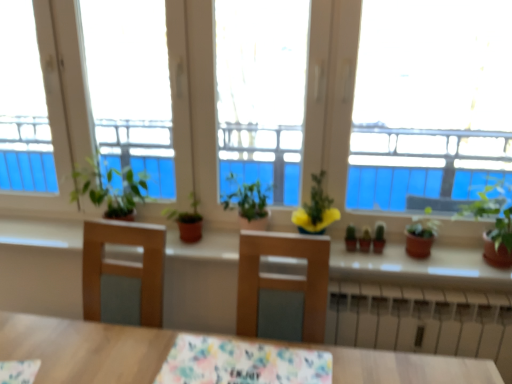
Question: Is green matte plant at center, the 5th houseplant from the right, in contact with transparent glass window at center?

Choices:
 (A) yes
 (B) no

Answer: (B)

Question: Does green matte plant at center, the 5th houseplant from the right, have a greater width compared to transparent glass window at center?

Choices:
 (A) yes
 (B) no

Answer: (A)

Question: Can you confirm if green matte plant at center, the 5th houseplant from the right, is smaller than transparent glass window at center?

Choices:
 (A) no
 (B) yes

Answer: (B)

Question: From a real-world perspective, is green matte plant at center, the 5th houseplant from the right, located higher than transparent glass window at center?

Choices:
 (A) yes
 (B) no

Answer: (B)

Question: Considering the relative sizes of green matte plant at center, the 5th houseplant from the right, and transparent glass window at center in the image provided, is green matte plant at center, the 5th houseplant from the right, taller than transparent glass window at center?

Choices:
 (A) no
 (B) yes

Answer: (A)

Question: Can transparent glass window at center be found inside green matte plant at center, the 5th houseplant from the right?

Choices:
 (A) yes
 (B) no

Answer: (B)

Question: From a real-world perspective, is yellow matte flower pot at center, the third houseplant when ordered from left to right, positioned under white metallic radiator at lower center based on gravity?

Choices:
 (A) yes
 (B) no

Answer: (B)

Question: Considering the relative positions of yellow matte flower pot at center, the third houseplant when ordered from left to right, and white metallic radiator at lower center in the image provided, is yellow matte flower pot at center, the third houseplant when ordered from left to right, to the left of white metallic radiator at lower center from the viewer's perspective?

Choices:
 (A) yes
 (B) no

Answer: (A)

Question: Is yellow matte flower pot at center, the third houseplant when ordered from left to right, directly adjacent to white metallic radiator at lower center?

Choices:
 (A) yes
 (B) no

Answer: (B)

Question: Considering the relative positions of yellow matte flower pot at center, which ranks as the third houseplant in right-to-left order, and white metallic radiator at lower center in the image provided, is yellow matte flower pot at center, which ranks as the third houseplant in right-to-left order, behind white metallic radiator at lower center?

Choices:
 (A) yes
 (B) no

Answer: (B)

Question: Could white metallic radiator at lower center be considered to be inside yellow matte flower pot at center, the third houseplant when ordered from left to right?

Choices:
 (A) no
 (B) yes

Answer: (A)

Question: Considering the relative sizes of yellow matte flower pot at center, which ranks as the third houseplant in right-to-left order, and white metallic radiator at lower center in the image provided, is yellow matte flower pot at center, which ranks as the third houseplant in right-to-left order, smaller than white metallic radiator at lower center?

Choices:
 (A) yes
 (B) no

Answer: (A)

Question: Is floral fabric tablecloth at center thinner than green matte plant at center, the 5th houseplant from the right?

Choices:
 (A) no
 (B) yes

Answer: (A)